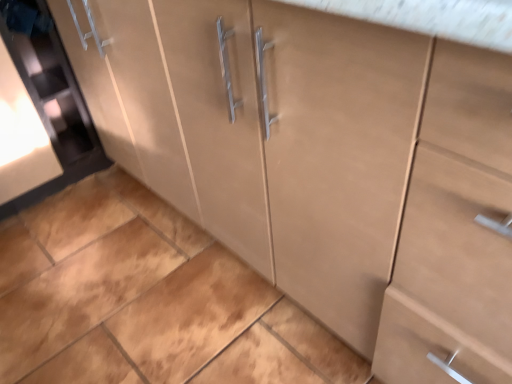
This screenshot has height=384, width=512. What do you see at coordinates (145, 299) in the screenshot? I see `brown matte tile at center` at bounding box center [145, 299].

This screenshot has height=384, width=512. I want to click on brown matte tile at center, so click(145, 299).

At what (x,y) coordinates should I click in order to perform the action: click on brown matte tile at center. Please return your answer as a coordinate pair (x, y). The height and width of the screenshot is (384, 512). Looking at the image, I should click on (145, 299).